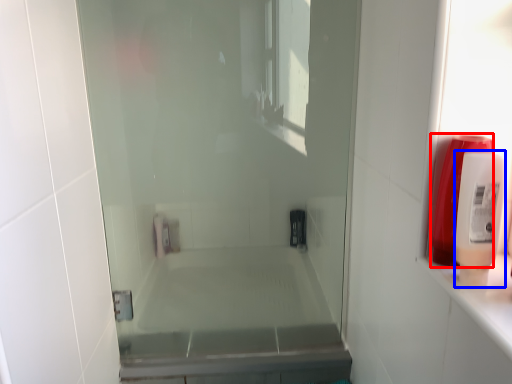
Question: Which of the following is the farthest to the observer, soap dispenser (highlighted by a red box) or soap dispenser (highlighted by a blue box)?

Choices:
 (A) soap dispenser
 (B) soap dispenser

Answer: (A)